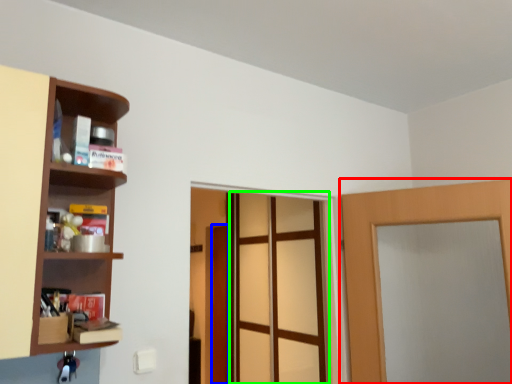
Question: Which object is the farthest from door (highlighted by a red box)? Choose among these: door (highlighted by a blue box) or screen door (highlighted by a green box).

Choices:
 (A) door
 (B) screen door

Answer: (A)